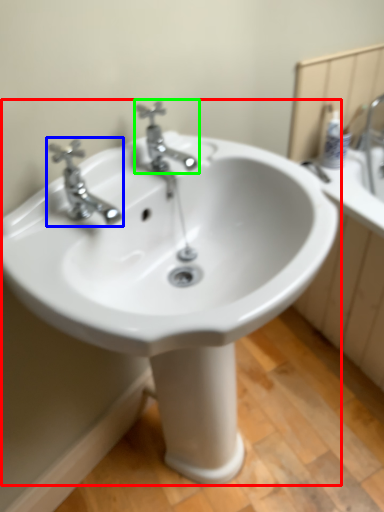
Question: Which object is positioned farthest from sink (highlighted by a red box)? Select from tap (highlighted by a blue box) and tap (highlighted by a green box).

Choices:
 (A) tap
 (B) tap

Answer: (B)